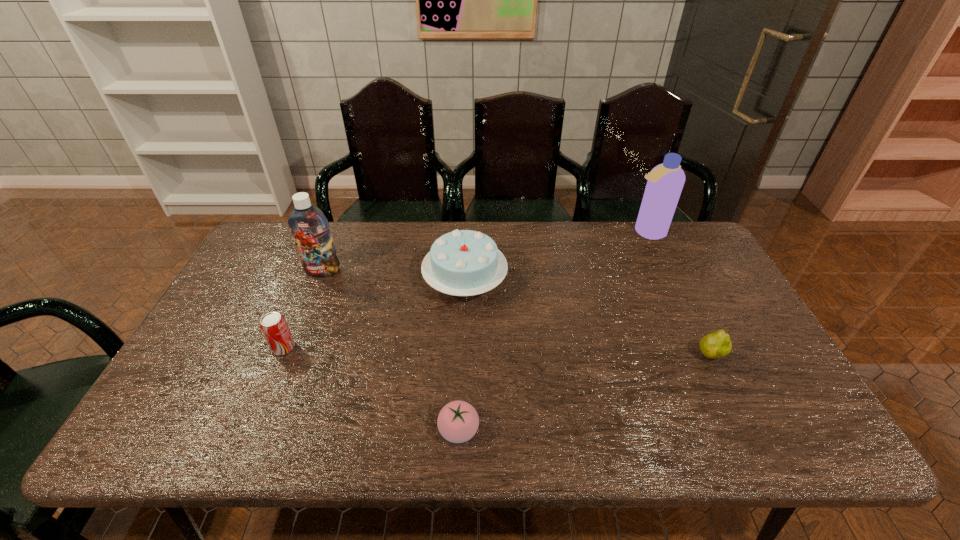
Where is `free space at the right edge of the desktop`? free space at the right edge of the desktop is located at coordinates (741, 354).

Find the location of `vacant space at the far left corner of the desktop`. vacant space at the far left corner of the desktop is located at coordinates (256, 231).

Locate an element on the screen. This screenshot has width=960, height=540. vacant space at the far right corner is located at coordinates (669, 230).

Image resolution: width=960 pixels, height=540 pixels. What are the coordinates of `empty space between the biggest white detergent and the smallest white detergent` in the screenshot? It's located at (737, 313).

This screenshot has height=540, width=960. I want to click on free space between the pumpkin and the biggest red detergent, so click(x=390, y=282).

The width and height of the screenshot is (960, 540). What are the coordinates of `free space that is in between the orange pumpkin and the nearest white detergent` in the screenshot? It's located at (564, 350).

Locate an element on the screen. Image resolution: width=960 pixels, height=540 pixels. free spot between the third biggest red detergent and the orange pumpkin is located at coordinates (423, 333).

Locate an element on the screen. Image resolution: width=960 pixels, height=540 pixels. vacant point located between the teddy bear and the nearest red detergent is located at coordinates (412, 380).

The height and width of the screenshot is (540, 960). I want to click on vacant area that lies between the fifth detergent from left to right and the leftmost white detergent, so coord(397,251).

Identify the location of free space that is in between the sixth object from left to right and the smallest white detergent. This screenshot has height=540, width=960. (660, 292).